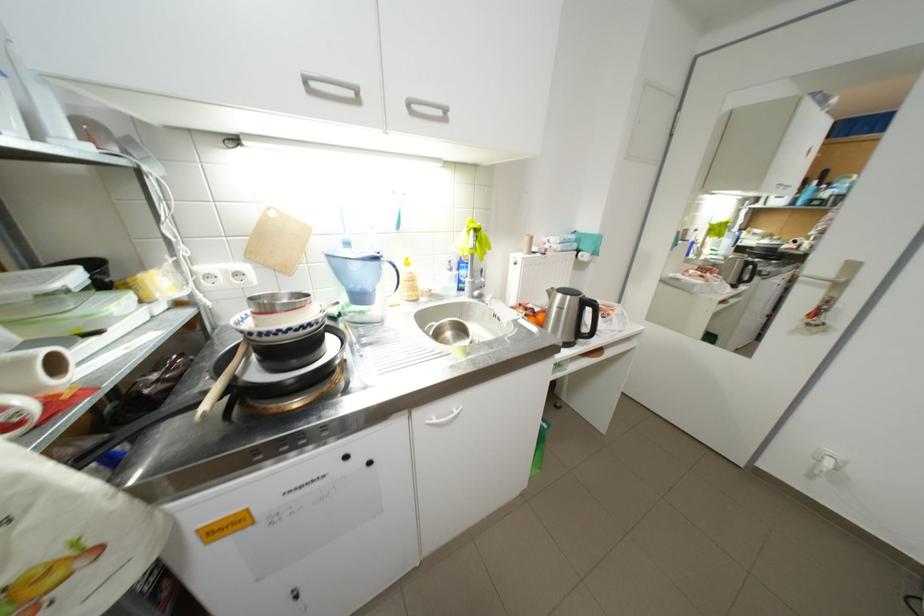
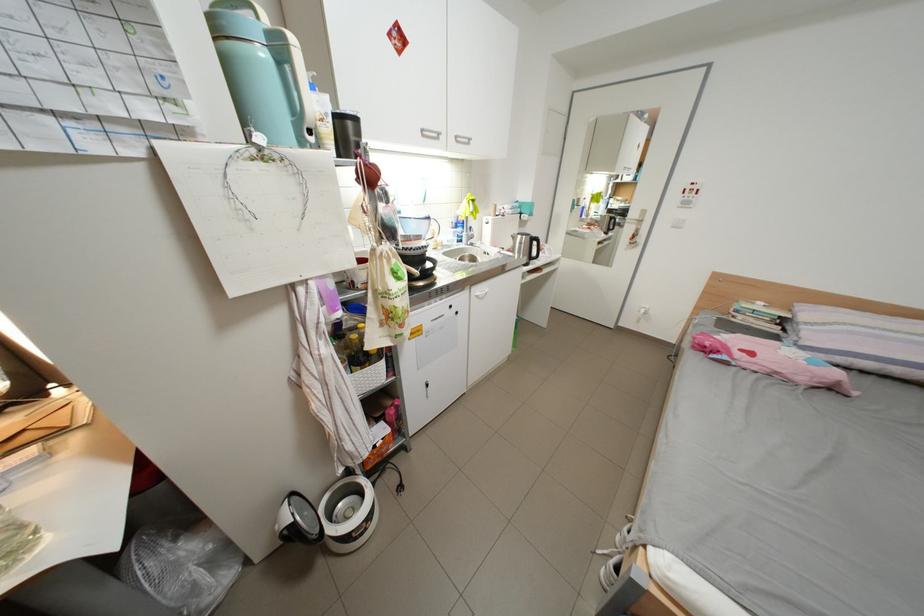
In a continuous first-person perspective shot, in which direction is the camera moving?

The movement direction of the cameraman is left, backward.